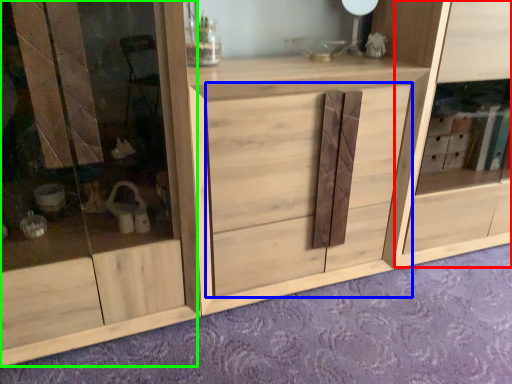
Question: Considering the real-world distances, which object is farthest from cabinet (highlighted by a red box)? drawer (highlighted by a blue box) or screen door (highlighted by a green box)?

Choices:
 (A) drawer
 (B) screen door

Answer: (B)